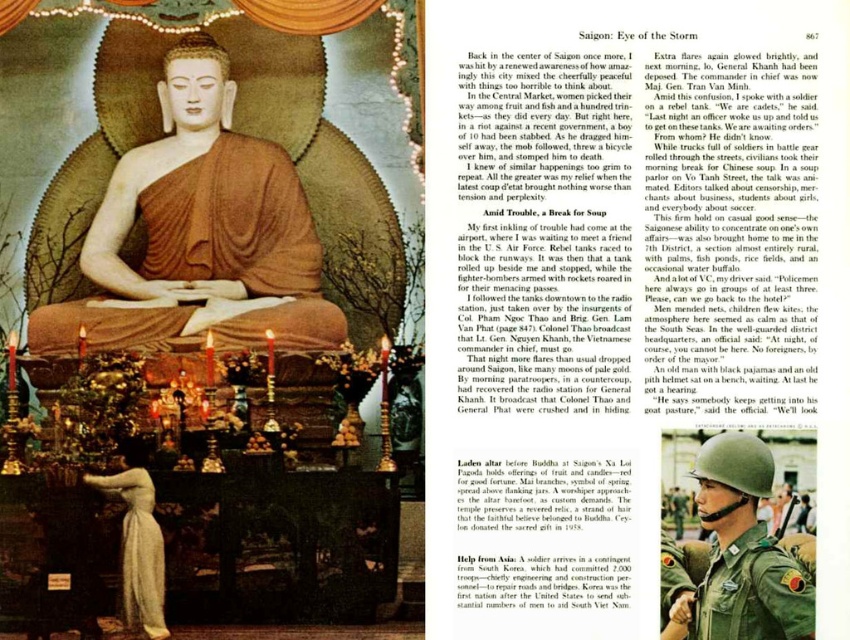
Is point (116, 198) behind point (756, 609)?

Yes.

Image resolution: width=850 pixels, height=640 pixels. I want to click on matte gold statue at center, so click(197, 234).

You are a GUI agent. You are given a task and a screenshot of the screen. Output one action in this format:
    pyautogui.click(x=<x>, y=<y>)
    Task: Click on the matte gold statue at center
    The width and height of the screenshot is (850, 640).
    Given the screenshot: What is the action you would take?
    tap(197, 234)

Does green uniform helmet at center come in front of green fabric helmet at center?

Yes, green uniform helmet at center is in front of green fabric helmet at center.

Is point (703, 614) closer to camera compared to point (748, 636)?

No, (703, 614) is further to viewer.

Identify the location of green uniform helmet at center. (741, 552).

What do you see at coordinates (197, 234) in the screenshot? I see `matte gold statue at center` at bounding box center [197, 234].

Is matte gold statue at center taller than green fabric helmet at center?

Correct, matte gold statue at center is much taller as green fabric helmet at center.

Is point (276, 179) positioned behind point (799, 624)?

That is True.

This screenshot has height=640, width=850. Find the location of `matte gold statue at center`. matte gold statue at center is located at coordinates (197, 234).